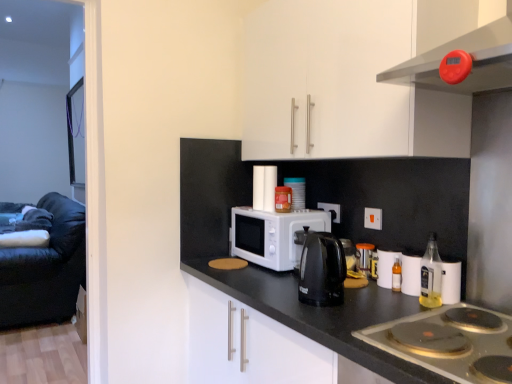
This screenshot has height=384, width=512. In order to click on free space in front of translucent plastic container at center, which is the first appliance in left-to-right order in this screenshot , I will do `click(300, 213)`.